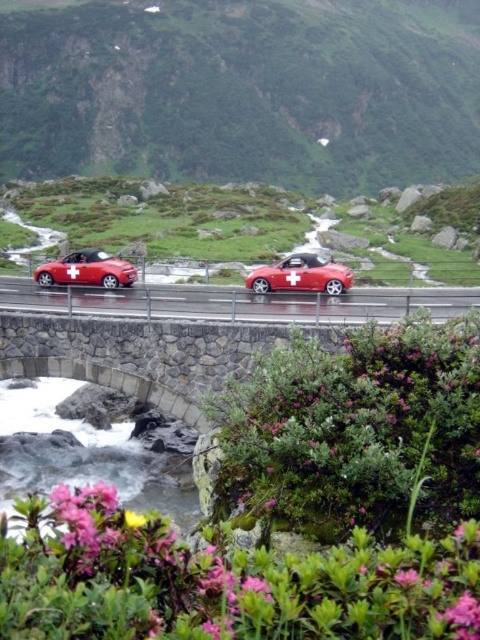
Question: Is red matte car at center further to camera compared to smooth yellow flower at lower left?

Choices:
 (A) yes
 (B) no

Answer: (A)

Question: Does white smooth water at center have a greater width compared to shiny red convertible at left?

Choices:
 (A) yes
 (B) no

Answer: (A)

Question: Does white smooth water at center appear under metallic red convertible at center?

Choices:
 (A) no
 (B) yes

Answer: (B)

Question: Which of the following is the farthest from the observer?

Choices:
 (A) (181, 308)
 (B) (322, 269)
 (C) (131, 524)
 (D) (101, 472)

Answer: (B)

Question: Which point is closer to the camera?

Choices:
 (A) (126, 509)
 (B) (73, 456)

Answer: (A)

Question: Based on their relative distances, which object is farther from the red matte car at center?

Choices:
 (A) white smooth water at center
 (B) metallic red convertible at center
 (C) shiny red convertible at left
 (D) smooth yellow flower at lower left

Answer: (D)